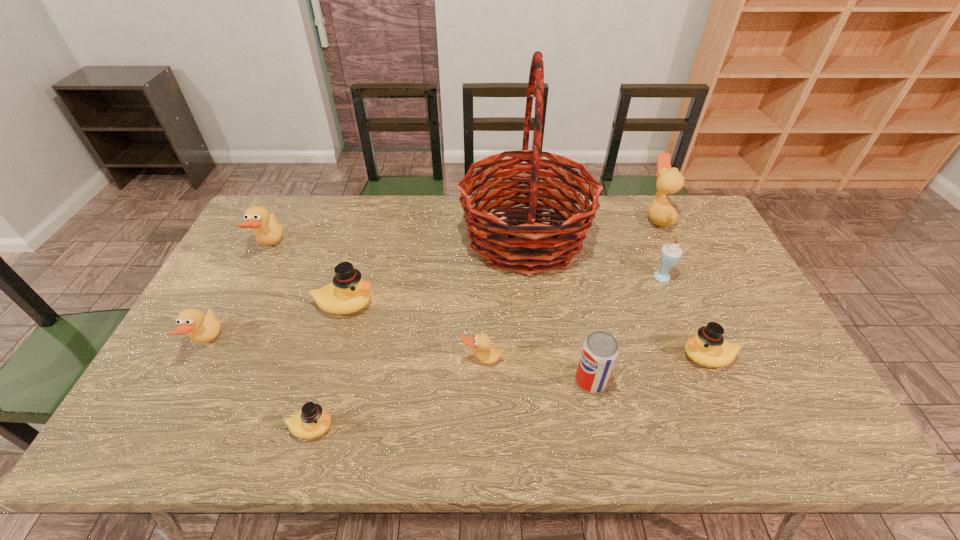
Locate an element on the screen. free space at the far right corner is located at coordinates (695, 204).

At what (x,y) coordinates should I click in order to perform the action: click on free spot between the soda and the rightmost yellow duck. Please return your answer as a coordinate pair (x, y). This screenshot has height=540, width=960. Looking at the image, I should click on (649, 368).

You are a GUI agent. You are given a task and a screenshot of the screen. Output one action in this format:
    pyautogui.click(x=<x>, y=<y>)
    Task: Click on the vacant area that lies between the tallest duck and the milkshake
    Image resolution: width=960 pixels, height=540 pixels.
    Given the screenshot: What is the action you would take?
    pyautogui.click(x=660, y=248)

Find the location of a particular element. The width and height of the screenshot is (960, 540). vacant space that is in between the soda and the third biggest tan duck is located at coordinates (399, 361).

Identify the location of free space between the basket and the nearest yellow duck. (419, 333).

Find the location of a particular element. vacant area between the milkshake and the soda is located at coordinates (627, 329).

Locate an element on the screen. The width and height of the screenshot is (960, 540). vacant point located between the second tallest object and the third biggest tan duck is located at coordinates (432, 280).

Identify the location of vacant point located between the second tan duck from right to left and the soda. This screenshot has width=960, height=540. (537, 370).

Find the location of a particular element. The image size is (960, 540). free space that is in between the nearest object and the fifth duck from left to right is located at coordinates (397, 394).

Identify the location of vacant space in between the nearest duck and the rightmost tan duck. This screenshot has width=960, height=540. (485, 322).